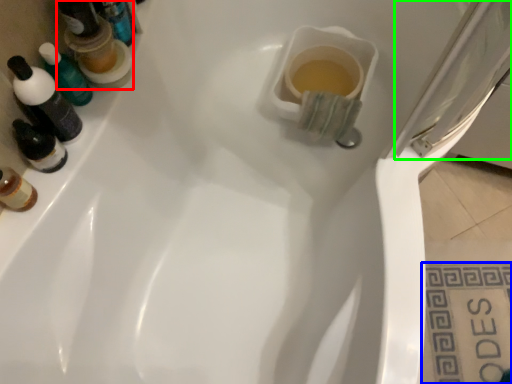
Question: Considering the real-world distances, which object is farthest from mouthwash (highlighted by a red box)? tile (highlighted by a blue box) or screen door (highlighted by a green box)?

Choices:
 (A) tile
 (B) screen door

Answer: (A)